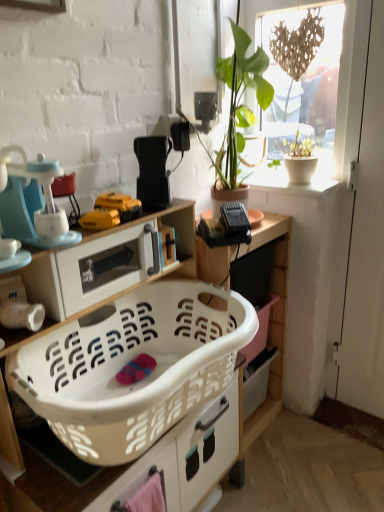
Question: Considering the relative positions of white plastic laundry basket at lower center, placed as the second cabinetry when sorted from back to front, and white plastic cabinet at center, which ranks as the second cabinetry in front-to-back order, in the image provided, is white plastic laundry basket at lower center, placed as the second cabinetry when sorted from back to front, to the right of white plastic cabinet at center, which ranks as the second cabinetry in front-to-back order, from the viewer's perspective?

Choices:
 (A) yes
 (B) no

Answer: (B)

Question: From a real-world perspective, is white plastic laundry basket at lower center, placed as the 1th cabinetry when sorted from front to back, under white plastic cabinet at center, the first cabinetry positioned from the back?

Choices:
 (A) yes
 (B) no

Answer: (B)

Question: Considering the relative sizes of white plastic laundry basket at lower center, placed as the 1th cabinetry when sorted from front to back, and white plastic cabinet at center, the first cabinetry positioned from the back, in the image provided, is white plastic laundry basket at lower center, placed as the 1th cabinetry when sorted from front to back, shorter than white plastic cabinet at center, the first cabinetry positioned from the back,?

Choices:
 (A) yes
 (B) no

Answer: (B)

Question: Is white plastic laundry basket at lower center, placed as the 1th cabinetry when sorted from front to back, behind white plastic cabinet at center, which ranks as the second cabinetry in front-to-back order?

Choices:
 (A) no
 (B) yes

Answer: (A)

Question: From a real-world perspective, is white plastic laundry basket at lower center, placed as the second cabinetry when sorted from back to front, located higher than white plastic cabinet at center, which ranks as the second cabinetry in front-to-back order?

Choices:
 (A) yes
 (B) no

Answer: (A)

Question: Considering the positions of matte blue blender at left, marked as the 2th appliance in a top-to-bottom arrangement, and transparent glass window at upper right in the image, is matte blue blender at left, marked as the 2th appliance in a top-to-bottom arrangement, bigger or smaller than transparent glass window at upper right?

Choices:
 (A) big
 (B) small

Answer: (B)

Question: Would you say matte blue blender at left, acting as the 2th appliance starting from the bottom, is to the left or to the right of transparent glass window at upper right in the picture?

Choices:
 (A) right
 (B) left

Answer: (B)

Question: From their relative heights in the image, would you say matte blue blender at left, acting as the 2th appliance starting from the bottom, is taller or shorter than transparent glass window at upper right?

Choices:
 (A) tall
 (B) short

Answer: (B)

Question: From a real-world perspective, is matte blue blender at left, acting as the 2th appliance starting from the bottom, above or below transparent glass window at upper right?

Choices:
 (A) above
 (B) below

Answer: (B)

Question: In terms of size, does yellow plastic drill at center, placed as the second toy when sorted from back to front, appear bigger or smaller than white matte screen door at right?

Choices:
 (A) big
 (B) small

Answer: (B)

Question: Would you say yellow plastic drill at center, placed as the second toy when sorted from back to front, is inside or outside white matte screen door at right?

Choices:
 (A) outside
 (B) inside

Answer: (A)

Question: From the image's perspective, is yellow plastic drill at center, the 1th toy viewed from the front, positioned above or below white matte screen door at right?

Choices:
 (A) below
 (B) above

Answer: (B)

Question: Would you say yellow plastic drill at center, placed as the second toy when sorted from back to front, is to the left or to the right of white matte screen door at right in the picture?

Choices:
 (A) left
 (B) right

Answer: (A)

Question: Is yellow plastic drill at center, the 1th toy viewed from the front, to the left or to the right of transparent glass window at upper right in the image?

Choices:
 (A) left
 (B) right

Answer: (A)

Question: Based on their sizes in the image, would you say yellow plastic drill at center, placed as the second toy when sorted from back to front, is bigger or smaller than transparent glass window at upper right?

Choices:
 (A) small
 (B) big

Answer: (A)